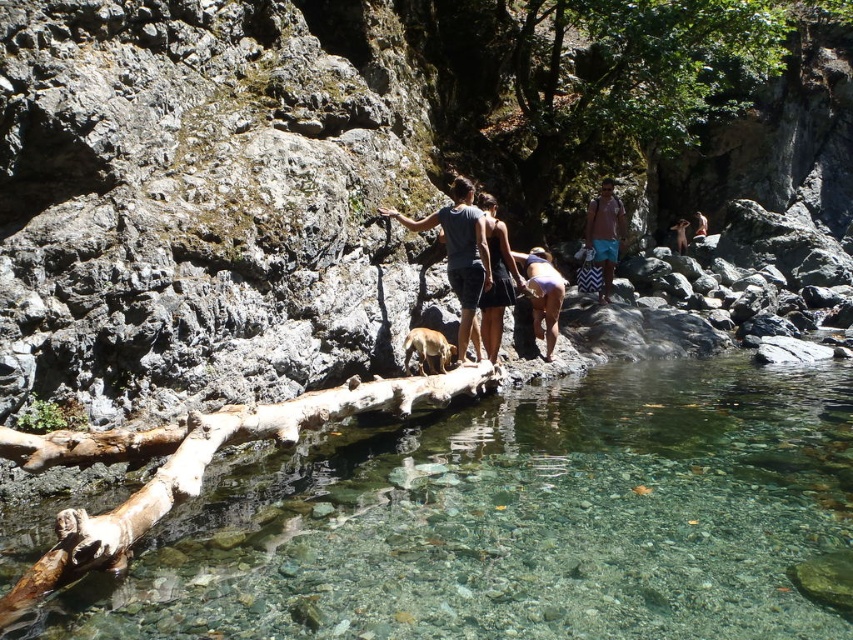
Question: From the image, what is the correct spatial relationship of dark gray fabric dress at center in relation to light brown wooden stick at center?

Choices:
 (A) below
 (B) above

Answer: (A)

Question: Which point is closer to the camera?

Choices:
 (A) clear water at center
 (B) blue striped shorts at center

Answer: (A)

Question: Is purple fabric at center to the left of brown leather jacket at upper right from the viewer's perspective?

Choices:
 (A) no
 (B) yes

Answer: (B)

Question: Does dark gray fabric dress at center appear on the right side of blue striped shorts at center?

Choices:
 (A) yes
 (B) no

Answer: (B)

Question: Which of the following is the closest to the observer?

Choices:
 (A) (445, 241)
 (B) (496, 333)
 (C) (604, 228)

Answer: (A)

Question: Among these points, which one is nearest to the camera?

Choices:
 (A) (428, 353)
 (B) (675, 225)
 (C) (700, 232)
 (D) (463, 202)

Answer: (A)